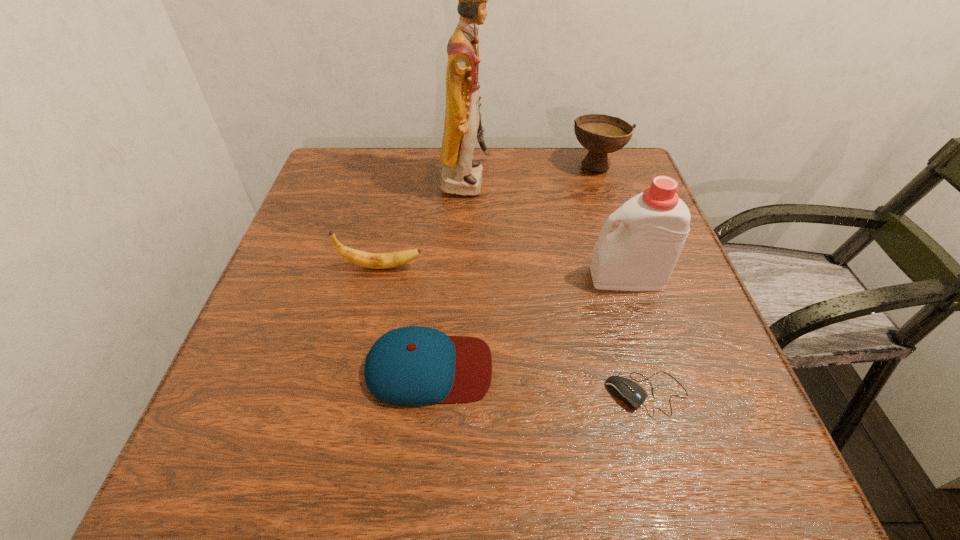
At what (x,y) coordinates should I click in order to perform the action: click on free space between the tallest object and the second tallest object. Please return your answer as a coordinate pair (x, y). This screenshot has width=960, height=540. Looking at the image, I should click on (546, 229).

Locate an element on the screen. This screenshot has width=960, height=540. free space between the fourth tallest object and the tallest object is located at coordinates (423, 224).

At what (x,y) coordinates should I click in order to perform the action: click on empty space that is in between the fifth tallest object and the shortest object. Please return your answer as a coordinate pair (x, y). Image resolution: width=960 pixels, height=540 pixels. Looking at the image, I should click on (538, 381).

The width and height of the screenshot is (960, 540). Find the location of `vacant point located between the computer mouse and the detergent`. vacant point located between the computer mouse and the detergent is located at coordinates (637, 336).

At what (x,y) coordinates should I click in order to perform the action: click on free space that is in between the nutcracker and the soup bowl. Please return your answer as a coordinate pair (x, y). Looking at the image, I should click on [531, 173].

Where is `vacant area between the fourth tallest object and the second shortest object`? vacant area between the fourth tallest object and the second shortest object is located at coordinates coord(405,318).

This screenshot has width=960, height=540. What are the coordinates of `free area in between the nutcracker and the soup bowl` in the screenshot? It's located at (531, 173).

Choose which object is the fourth nearest neighbor to the tallest object. Please provide its 2D coordinates. Your answer should be formatted as a tuple, i.e. [(x, y)], where the tuple contains the x and y coordinates of a point satisfying the conditions above.

[(411, 366)]

Locate which object ranks in proximity to the tallest object. Please provide its 2D coordinates. Your answer should be formatted as a tuple, i.e. [(x, y)], where the tuple contains the x and y coordinates of a point satisfying the conditions above.

[(364, 259)]

Find the location of a particular element. Image resolution: width=960 pixels, height=540 pixels. vacant space that satisfies the following two spatial constraints: 1. on the peel of the banana from the top; 2. on the left side of the computer mouse is located at coordinates (353, 394).